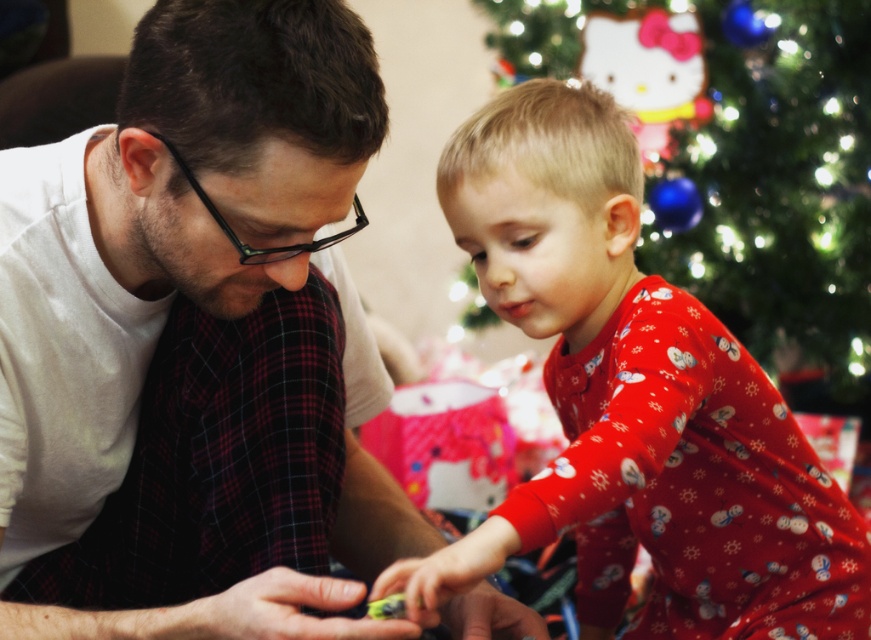
Question: From the image, what is the correct spatial relationship of red cotton pajamas at center in relation to green matte christmas tree at upper center?

Choices:
 (A) above
 (B) below

Answer: (B)

Question: Which of the following is the farthest from the observer?

Choices:
 (A) white matte shirt at center
 (B) green matte christmas tree at upper center

Answer: (B)

Question: Which of the following is the farthest from the observer?

Choices:
 (A) (690, 502)
 (B) (726, 124)
 (C) (292, 356)

Answer: (B)

Question: Does red cotton pajamas at center come behind green matte christmas tree at upper center?

Choices:
 (A) yes
 (B) no

Answer: (B)

Question: Based on their relative distances, which object is farther from the white matte shirt at center?

Choices:
 (A) red cotton pajamas at center
 (B) green matte christmas tree at upper center

Answer: (B)

Question: Can you confirm if white matte shirt at center is bigger than red cotton pajamas at center?

Choices:
 (A) yes
 (B) no

Answer: (B)